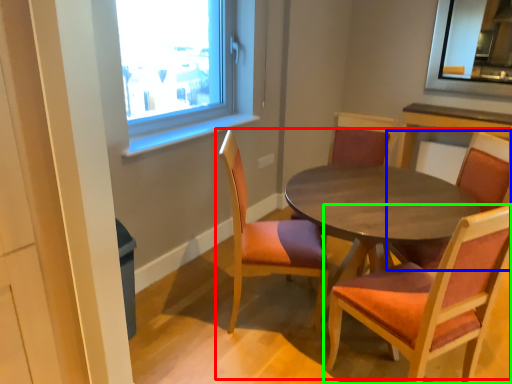
Question: Based on their relative distances, which object is farther from kitchen & dining room table (highlighted by a red box)? Choose from chair (highlighted by a blue box) and chair (highlighted by a green box).

Choices:
 (A) chair
 (B) chair

Answer: (B)